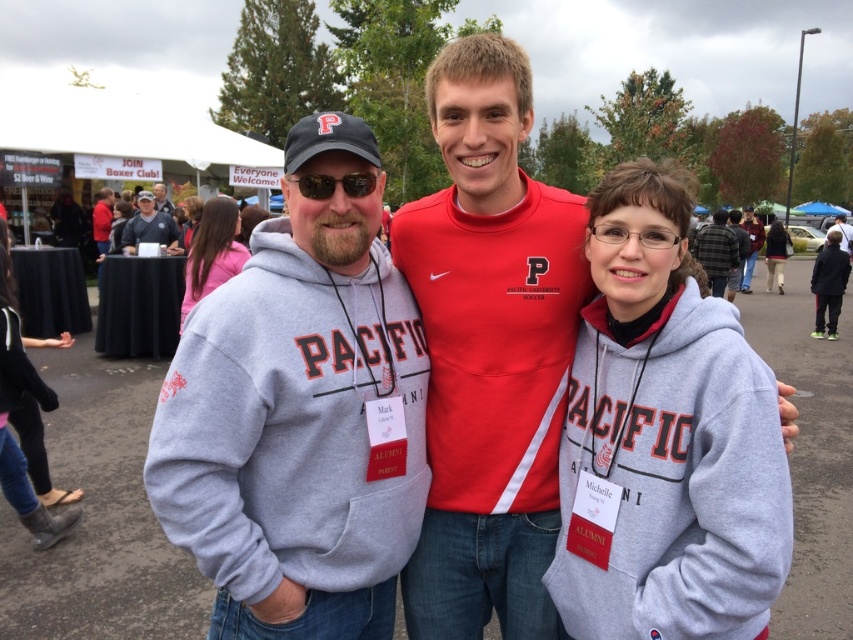
Question: Is gray fleece sweatshirt at left below maroon leather jacket at center?

Choices:
 (A) yes
 (B) no

Answer: (A)

Question: Does gray fleece sweatshirt at left have a greater width compared to matte black sunglasses at center?

Choices:
 (A) no
 (B) yes

Answer: (B)

Question: Which object is farther from the camera taking this photo?

Choices:
 (A) maroon leather jacket at center
 (B) matte black sunglasses at center

Answer: (A)

Question: Which object is farther from the camera taking this photo?

Choices:
 (A) matte black cap at upper left
 (B) matte gray hoodie at center
 (C) dark gray hoodie at center
 (D) matte red shirt at center

Answer: (A)

Question: Which object appears closest to the camera in this image?

Choices:
 (A) gray fleece sweatshirt at left
 (B) matte red hoodie at left

Answer: (A)

Question: Is dark gray hoodie at center wider than matte black laptop at left?

Choices:
 (A) yes
 (B) no

Answer: (A)